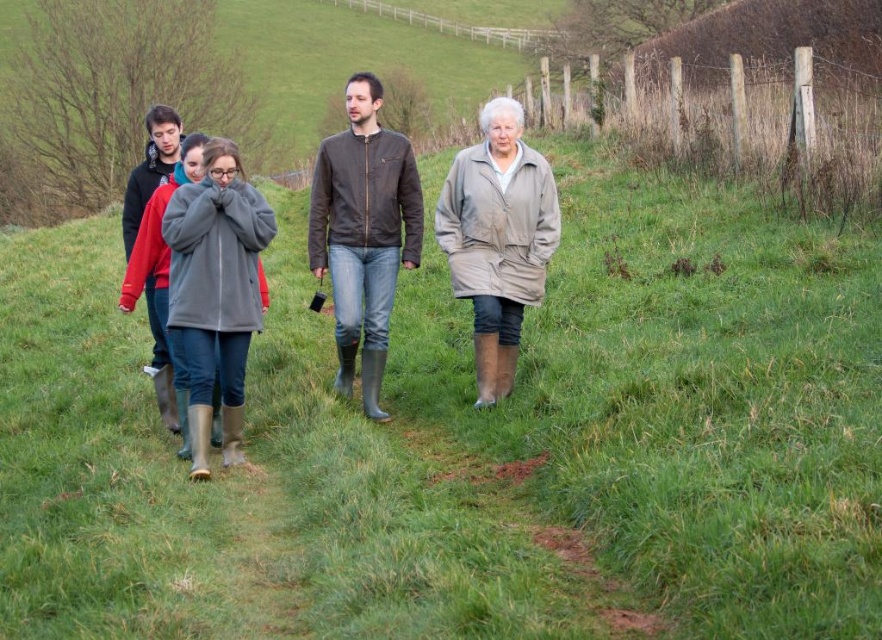
You are a photographer trying to capture a clear shot of the gray fleece coat at center without the brown leather jacket at center blocking it. Based on their positions, is this possible?

The brown leather jacket at center is positioned over gray fleece coat at center, so it is blocking the view. Therefore, it is not possible to capture a clear shot of the gray fleece coat at center without the brown leather jacket at center blocking it.

You are planning to take a walk on a grassy path with uneven terrain. You have both the rubber boots at center and the brown leather jacket at center. Which item should you choose to ensure better stability on the path?

The rubber boots at center should be chosen for better stability because their width is larger than the brown leather jacket at center, providing better grip on the uneven terrain.

You are a photographer trying to capture a closeup shot of both the rubber boots at center and the brown leather jacket at center in the scene. What is the minimum distance you need to maintain between the camera and the subjects to ensure both are in focus?

The minimum distance required to ensure both the rubber boots at center and the brown leather jacket at center are in focus is determined by their separation. Since they are 1.74 inches apart, you should maintain a distance where the depth of field can cover this gap. A general rule is to focus at the hyperfocal distance or use a small aperture to maximize depth of field, ensuring both subjects are sharp.